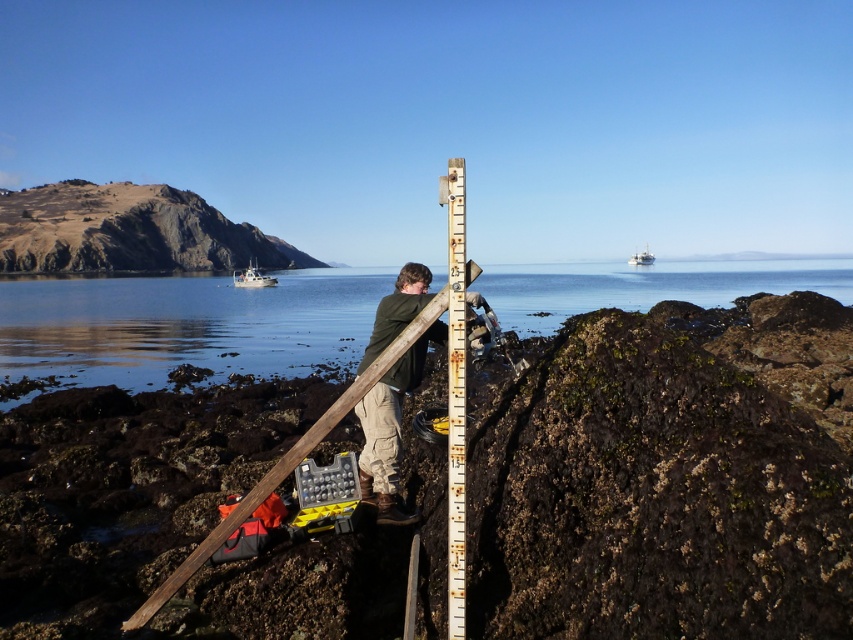
Between green matte jacket at center and white plastic boat at center, which one has more height?

Standing taller between the two is white plastic boat at center.

Does point (386, 504) come closer to viewer compared to point (641, 252)?

Yes, it is in front of point (641, 252).

This screenshot has height=640, width=853. In order to click on green matte jacket at center in this screenshot , I will do `click(390, 428)`.

Who is more forward, (80,376) or (386,468)?

Point (386,468) is more forward.

Between point (740, 291) and point (370, 496), which one is positioned behind?

The point (740, 291) is behind.

The height and width of the screenshot is (640, 853). I want to click on clear water at center, so click(184, 324).

At what (x,y) coordinates should I click in order to perform the action: click on clear water at center. Please return your answer as a coordinate pair (x, y). The width and height of the screenshot is (853, 640). Looking at the image, I should click on (184, 324).

Between green matte jacket at center and rusty metal ruler at center, which one appears on the left side from the viewer's perspective?

Positioned to the left is green matte jacket at center.

Who is more forward, (376,481) or (453,612)?

Point (453,612) is in front.

The height and width of the screenshot is (640, 853). Find the location of `green matte jacket at center`. green matte jacket at center is located at coordinates (390, 428).